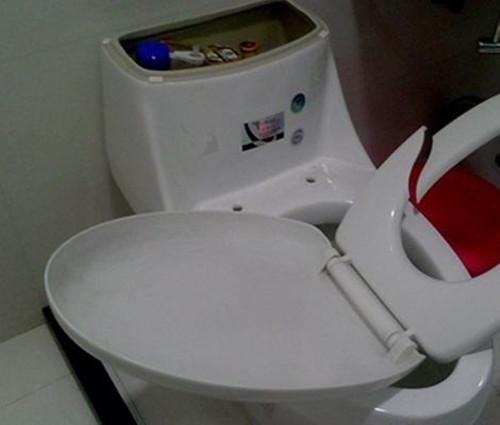
Identify the location of gray grout between tiles. This screenshot has width=500, height=425. (52, 380), (124, 386).